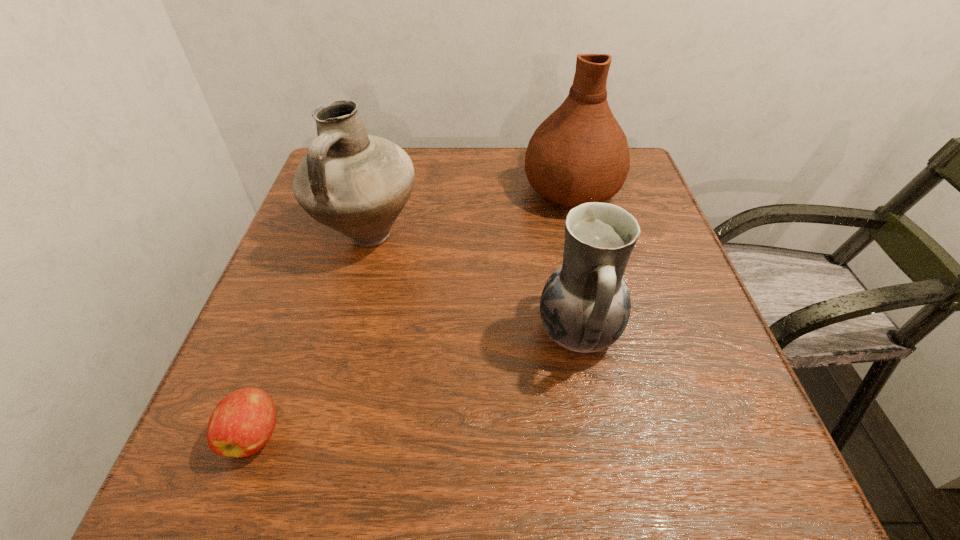
You are a GUI agent. You are given a task and a screenshot of the screen. Output one action in this format:
    pyautogui.click(x=<x>, y=<y>)
    Task: Click on the leftmost pitcher
    This screenshot has width=960, height=540.
    Given the screenshot: What is the action you would take?
    pyautogui.click(x=357, y=184)

Locate an element on the screen. This screenshot has height=540, width=960. the shortest pitcher is located at coordinates (585, 305).

Locate an element on the screen. This screenshot has height=540, width=960. the nearest pitcher is located at coordinates (585, 305).

This screenshot has height=540, width=960. I want to click on apple, so (x=242, y=423).

You are a GUI agent. You are given a task and a screenshot of the screen. Output one action in this format:
    pyautogui.click(x=<x>, y=<y>)
    Task: Click on the shortest object
    Image resolution: width=960 pixels, height=540 pixels.
    Given the screenshot: What is the action you would take?
    pyautogui.click(x=242, y=423)

Find the location of a particular element. This screenshot has height=540, width=960. free point located 0.330m on the handle side of the leftmost pitcher is located at coordinates (315, 433).

You are a GUI agent. You are given a task and a screenshot of the screen. Output one action in this format:
    pyautogui.click(x=<x>, y=<y>)
    Task: Click on the vacant space situated 0.100m on the front-facing side of the third farthest object
    This screenshot has width=960, height=540.
    Given the screenshot: What is the action you would take?
    pyautogui.click(x=480, y=332)

This screenshot has width=960, height=540. In order to click on vacant region located on the front-facing side of the third farthest object in this screenshot , I will do `click(401, 332)`.

I want to click on free region located 0.070m on the front-facing side of the third farthest object, so click(x=497, y=332).

Identify the location of vacant space positioned 0.220m on the right of the apple. (433, 435).